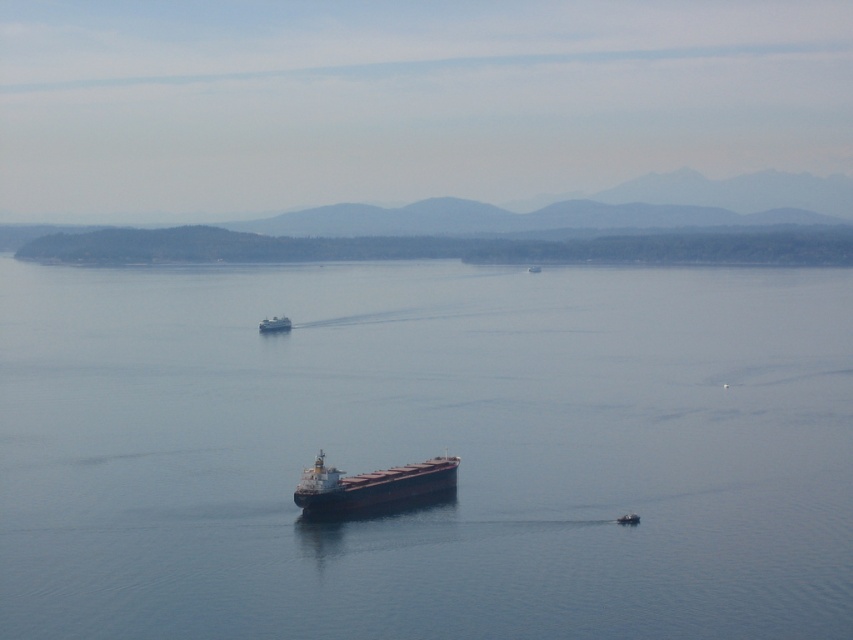
Who is more forward, (425, 480) or (531, 272)?

Point (425, 480)

Is dark brown matte cargo ship at center wider than metallic gray ship at center?

Yes, dark brown matte cargo ship at center is wider than metallic gray ship at center.

In order to click on dark brown matte cargo ship at center in this screenshot , I will do `click(373, 486)`.

Does dark blue water at center appear on the left side of dark brown matte cargo ship at center?

In fact, dark blue water at center is to the right of dark brown matte cargo ship at center.

Identify the location of dark blue water at center. (426, 451).

I want to click on dark blue water at center, so click(426, 451).

Can you confirm if dark brown matte cargo ship at center is smaller than metallic gray boat at center?

Incorrect, dark brown matte cargo ship at center is not smaller in size than metallic gray boat at center.

Does dark brown matte cargo ship at center have a lesser height compared to metallic gray boat at center?

Incorrect, dark brown matte cargo ship at center's height does not fall short of metallic gray boat at center's.

At what (x,y) coordinates should I click in order to perform the action: click on dark brown matte cargo ship at center. Please return your answer as a coordinate pair (x, y). Image resolution: width=853 pixels, height=640 pixels. Looking at the image, I should click on (373, 486).

The height and width of the screenshot is (640, 853). I want to click on dark brown matte cargo ship at center, so click(373, 486).